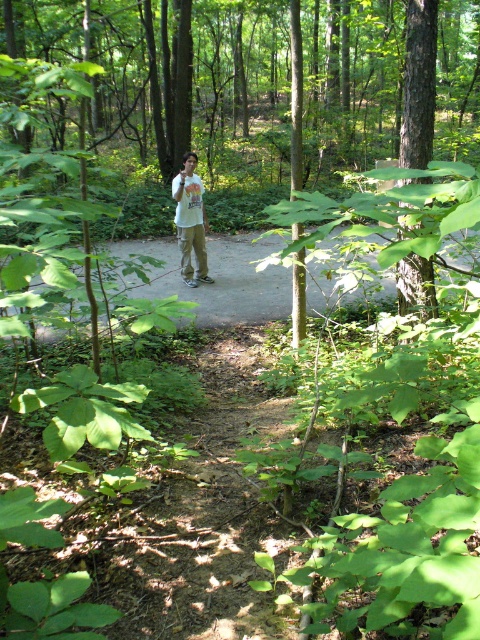
Can you confirm if dirt path at center is thinner than white cotton shirt at center?

In fact, dirt path at center might be wider than white cotton shirt at center.

Can you confirm if dirt path at center is wider than white cotton shirt at center?

Indeed, dirt path at center has a greater width compared to white cotton shirt at center.

Who is more forward, (139,250) or (184,189)?

Point (184,189) is more forward.

At what (x,y) coordinates should I click in order to perform the action: click on dirt path at center. Please return your answer as a coordinate pair (x, y). Looking at the image, I should click on (218, 278).